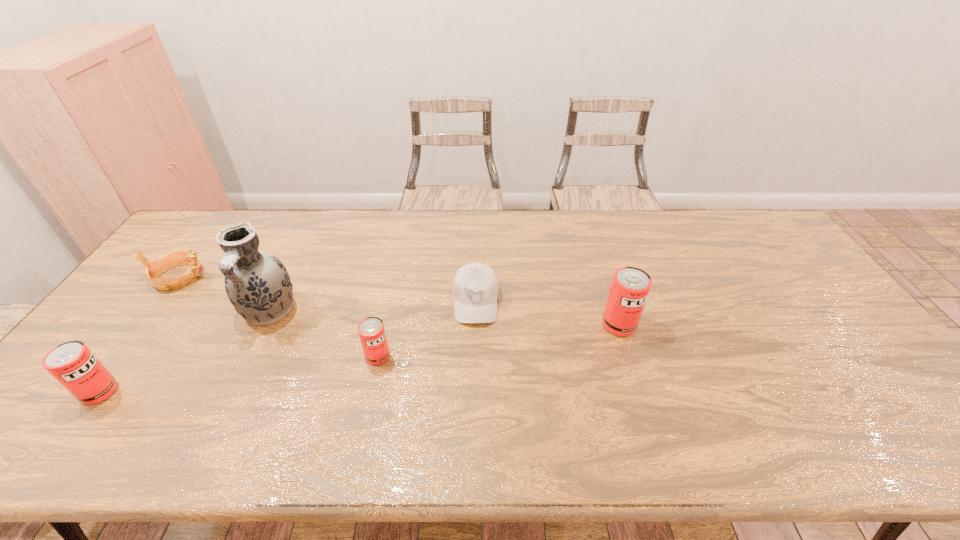
Given the evenly spaced cans in the image, where should an extra can be added on the right to preserve the spacing? Please point to a vacant space. Please provide its 2D coordinates. Your answer should be formatted as a tuple, i.e. [(x, y)], where the tuple contains the x and y coordinates of a point satisfying the conditions above.

[(830, 297)]